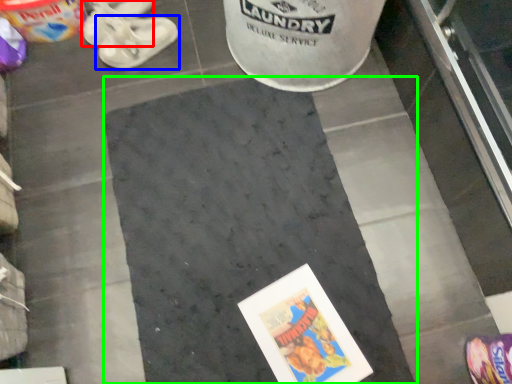
Question: Estimate the real-world distances between objects in this image. Which object is farther from footwear (highlighted by a red box), footwear (highlighted by a blue box) or concrete (highlighted by a green box)?

Choices:
 (A) footwear
 (B) concrete

Answer: (B)